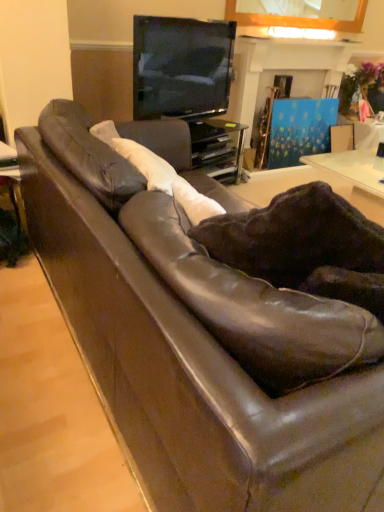
Question: Does leather swivel chair at center have a lesser height compared to matte black tv at upper center?

Choices:
 (A) yes
 (B) no

Answer: (A)

Question: Is leather swivel chair at center at the left side of matte black tv at upper center?

Choices:
 (A) yes
 (B) no

Answer: (B)

Question: Does leather swivel chair at center have a lesser width compared to matte black tv at upper center?

Choices:
 (A) yes
 (B) no

Answer: (B)

Question: From a real-world perspective, is leather swivel chair at center beneath matte black tv at upper center?

Choices:
 (A) no
 (B) yes

Answer: (B)

Question: Is leather swivel chair at center turned away from matte black tv at upper center?

Choices:
 (A) no
 (B) yes

Answer: (A)

Question: Is leather swivel chair at center in front of matte black tv at upper center?

Choices:
 (A) yes
 (B) no

Answer: (A)

Question: From a real-world perspective, is leather swivel chair at center under matte brown table at left?

Choices:
 (A) yes
 (B) no

Answer: (B)

Question: Is leather swivel chair at center smaller than matte brown table at left?

Choices:
 (A) yes
 (B) no

Answer: (B)

Question: Can you confirm if leather swivel chair at center is taller than matte brown table at left?

Choices:
 (A) no
 (B) yes

Answer: (A)

Question: Is leather swivel chair at center aimed at matte brown table at left?

Choices:
 (A) no
 (B) yes

Answer: (A)

Question: Is leather swivel chair at center to the left of matte brown table at left from the viewer's perspective?

Choices:
 (A) yes
 (B) no

Answer: (B)

Question: Considering the relative positions of leather swivel chair at center and matte brown table at left in the image provided, is leather swivel chair at center to the right of matte brown table at left from the viewer's perspective?

Choices:
 (A) no
 (B) yes

Answer: (B)

Question: Is black glass entertainment center at upper center positioned in front of leather swivel chair at center?

Choices:
 (A) yes
 (B) no

Answer: (B)